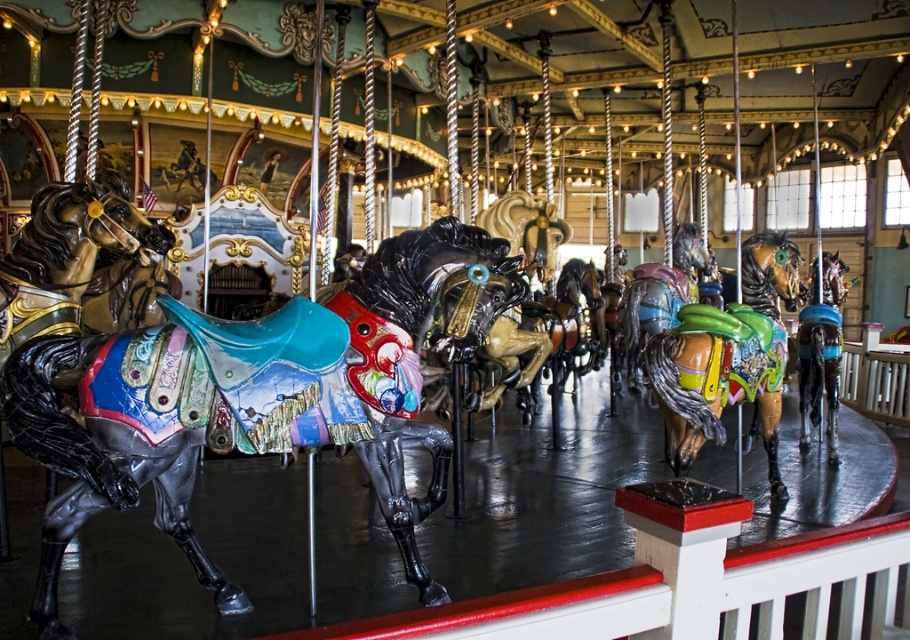
Looking at this image, you are a child who wants to touch the shiny brown horse at center. The maximum distance you can reach is 20 feet. Can you reach it?

The shiny brown horse at center is 24.48 feet away from camera, which is farther than your maximum reach of 20 feet. You cannot reach it.

You are standing in front of the carousel and notice two points marked on the carousel structure. The first point is at coordinate point(x=26, y=362) and the second is at point(x=810, y=376). Which point is closer to you?

Point(x=26, y=362) is closer to the viewer than point(x=810, y=376).